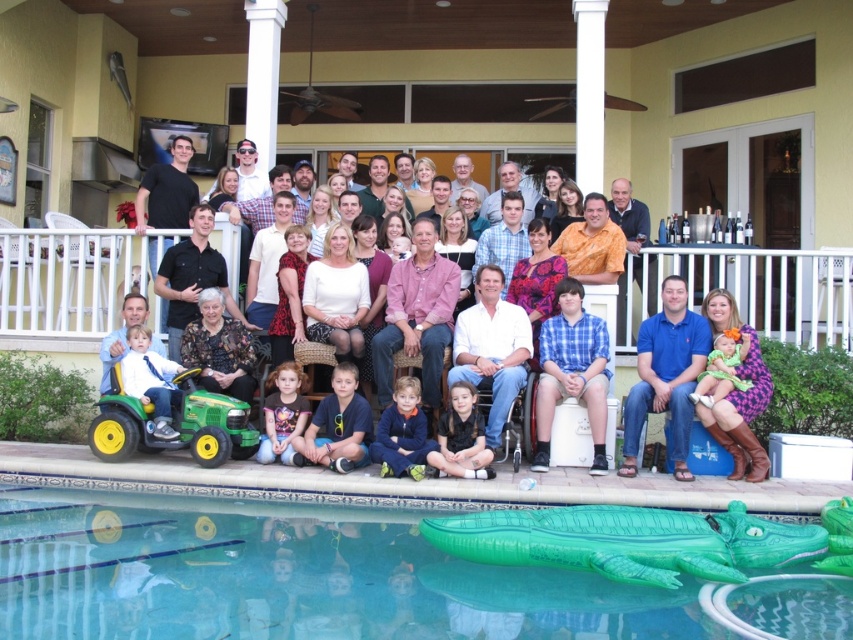
Question: Which point is closer to the camera?

Choices:
 (A) green inflatable crocodile at lower center
 (B) yellow rubber wheelchair at lower left

Answer: (A)

Question: Can you confirm if green inflatable crocodile at lower center is positioned below blue cotton shirt at lower right?

Choices:
 (A) no
 (B) yes

Answer: (B)

Question: Which point appears farthest from the camera in this image?

Choices:
 (A) (451, 380)
 (B) (654, 288)
 (C) (450, 372)

Answer: (B)

Question: Is blue plaid shirt at center positioned in front of dark blue fleece at center?

Choices:
 (A) yes
 (B) no

Answer: (B)

Question: Which point is farther from the camera taking this photo?

Choices:
 (A) (701, 394)
 (B) (688, 378)

Answer: (B)

Question: Is white wicker basket at center above blue plaid shirt at center?

Choices:
 (A) yes
 (B) no

Answer: (A)